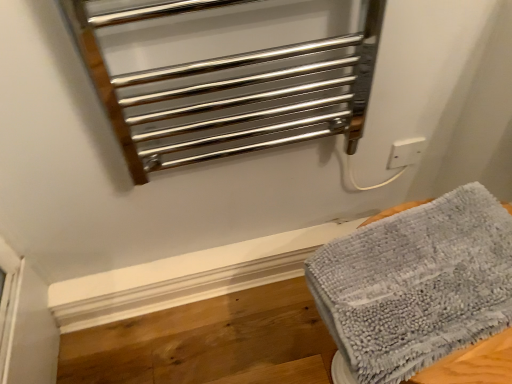
Question: Does gray fluffy towel at lower right come behind white plastic electric outlet at upper right?

Choices:
 (A) no
 (B) yes

Answer: (A)

Question: Is gray fluffy towel at lower right located outside white plastic electric outlet at upper right?

Choices:
 (A) yes
 (B) no

Answer: (A)

Question: Can you confirm if gray fluffy towel at lower right is positioned to the left of white plastic electric outlet at upper right?

Choices:
 (A) no
 (B) yes

Answer: (B)

Question: Are gray fluffy towel at lower right and white plastic electric outlet at upper right beside each other?

Choices:
 (A) no
 (B) yes

Answer: (A)

Question: Does gray fluffy towel at lower right have a lesser height compared to white plastic electric outlet at upper right?

Choices:
 (A) yes
 (B) no

Answer: (B)

Question: Is white plastic electric outlet at upper right bigger or smaller than gray fluffy towel at lower right?

Choices:
 (A) big
 (B) small

Answer: (B)

Question: In terms of width, does white plastic electric outlet at upper right look wider or thinner when compared to gray fluffy towel at lower right?

Choices:
 (A) thin
 (B) wide

Answer: (A)

Question: From the image's perspective, is white plastic electric outlet at upper right located above or below gray fluffy towel at lower right?

Choices:
 (A) below
 (B) above

Answer: (B)

Question: From a real-world perspective, is white plastic electric outlet at upper right positioned above or below gray fluffy towel at lower right?

Choices:
 (A) below
 (B) above

Answer: (A)

Question: In the image, is polished metal towel rack at upper center positioned in front of or behind gray fluffy towel at lower right?

Choices:
 (A) behind
 (B) front

Answer: (B)

Question: Considering the positions of polished metal towel rack at upper center and gray fluffy towel at lower right in the image, is polished metal towel rack at upper center taller or shorter than gray fluffy towel at lower right?

Choices:
 (A) tall
 (B) short

Answer: (A)

Question: Is point (200, 119) closer or farther from the camera than point (354, 349)?

Choices:
 (A) farther
 (B) closer

Answer: (A)

Question: From the image's perspective, is polished metal towel rack at upper center located above or below gray fluffy towel at lower right?

Choices:
 (A) above
 (B) below

Answer: (A)

Question: Considering the positions of white plastic electric outlet at upper right and polished metal towel rack at upper center in the image, is white plastic electric outlet at upper right taller or shorter than polished metal towel rack at upper center?

Choices:
 (A) short
 (B) tall

Answer: (A)

Question: Considering the positions of point (406, 153) and point (339, 132), is point (406, 153) closer or farther from the camera than point (339, 132)?

Choices:
 (A) farther
 (B) closer

Answer: (A)